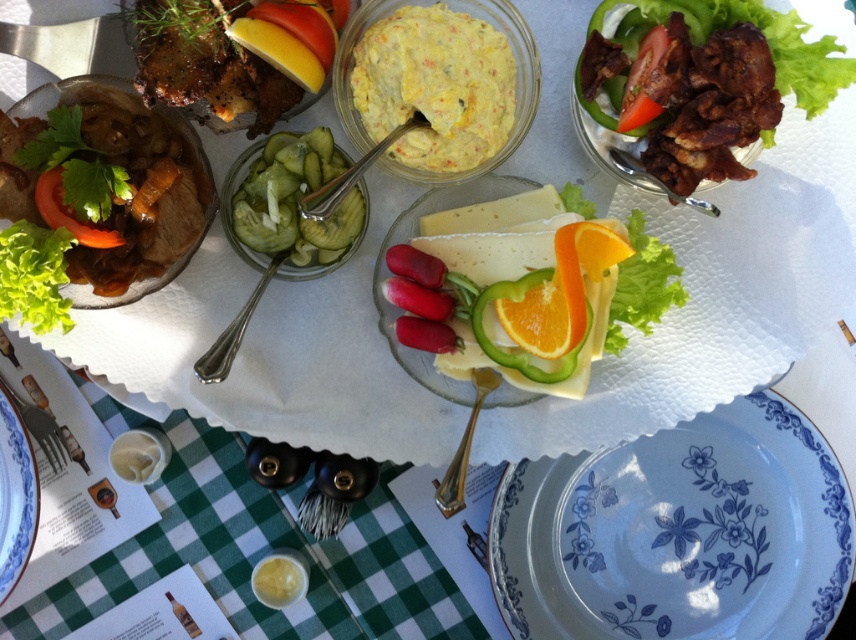
Question: Which of the following is the closest to the observer?

Choices:
 (A) green pickled cucumber at center
 (B) shiny brown bacon at upper right

Answer: (B)

Question: Considering the real-world distances, which object is farthest from the shiny brown bacon at upper right?

Choices:
 (A) green pickled cucumber at center
 (B) blue floral plate at lower right
 (C) green leafy salad at left
 (D) blue floral plate at center

Answer: (B)

Question: Can you confirm if shiny brown bacon at upper right is bigger than blue floral plate at lower right?

Choices:
 (A) no
 (B) yes

Answer: (B)

Question: Which point is closer to the camera?

Choices:
 (A) blue floral plate at lower right
 (B) green pickled cucumber at center
 (C) shiny brown bacon at upper right
 (D) blue floral plate at center

Answer: (C)

Question: Does yellow creamy spread at center have a greater width compared to green leafy salad at left?

Choices:
 (A) yes
 (B) no

Answer: (B)

Question: Is green pickled cucumber at center to the left of green leafy salad at left from the viewer's perspective?

Choices:
 (A) yes
 (B) no

Answer: (B)